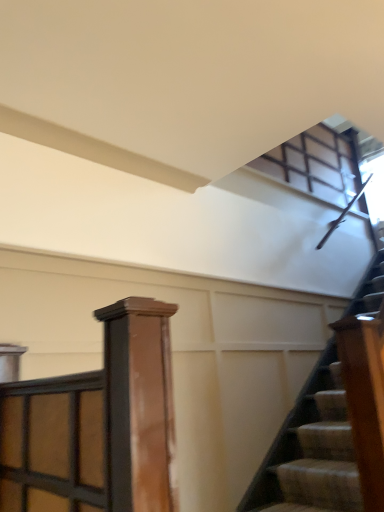
The height and width of the screenshot is (512, 384). Identify the location of clear glass door at left. (53, 441).

Describe the element at coordinates (53, 441) in the screenshot. I see `clear glass door at left` at that location.

Find the location of `clear glass door at left`. clear glass door at left is located at coordinates (53, 441).